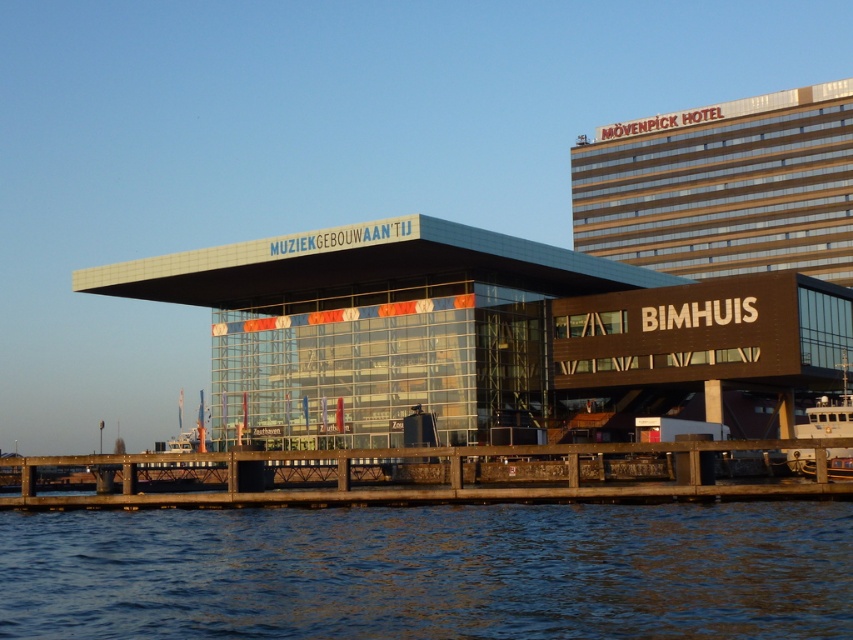
Can you confirm if blue liquid water at lower center is smaller than glassy modern building at center?

Yes, blue liquid water at lower center is smaller than glassy modern building at center.

Is point (677, 632) positioned behind point (527, 289)?

No, it is not.

The width and height of the screenshot is (853, 640). In order to click on blue liquid water at lower center in this screenshot , I will do `click(431, 572)`.

Does gold reflective glass building at upper right lie in front of brown wooden dock at lower center?

No, gold reflective glass building at upper right is behind brown wooden dock at lower center.

Can you confirm if gold reflective glass building at upper right is bigger than brown wooden dock at lower center?

Yes.

The image size is (853, 640). I want to click on gold reflective glass building at upper right, so click(723, 186).

I want to click on gold reflective glass building at upper right, so click(x=723, y=186).

You are a GUI agent. You are given a task and a screenshot of the screen. Output one action in this format:
    pyautogui.click(x=<x>, y=<y>)
    Task: Click on the blue liquid water at lower center
    The width and height of the screenshot is (853, 640).
    Given the screenshot: What is the action you would take?
    pyautogui.click(x=431, y=572)

Is point (71, 579) positioned after point (317, 490)?

No, it is in front of (317, 490).

This screenshot has width=853, height=640. What are the coordinates of `blue liquid water at lower center` in the screenshot? It's located at (431, 572).

The width and height of the screenshot is (853, 640). Identify the location of blue liquid water at lower center. (431, 572).